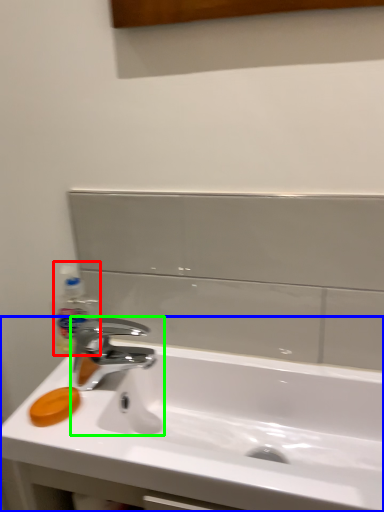
Question: Based on their relative distances, which object is nearer to bottle (highlighted by a red box)? Choose from sink (highlighted by a blue box) and tap (highlighted by a green box).

Choices:
 (A) sink
 (B) tap

Answer: (B)